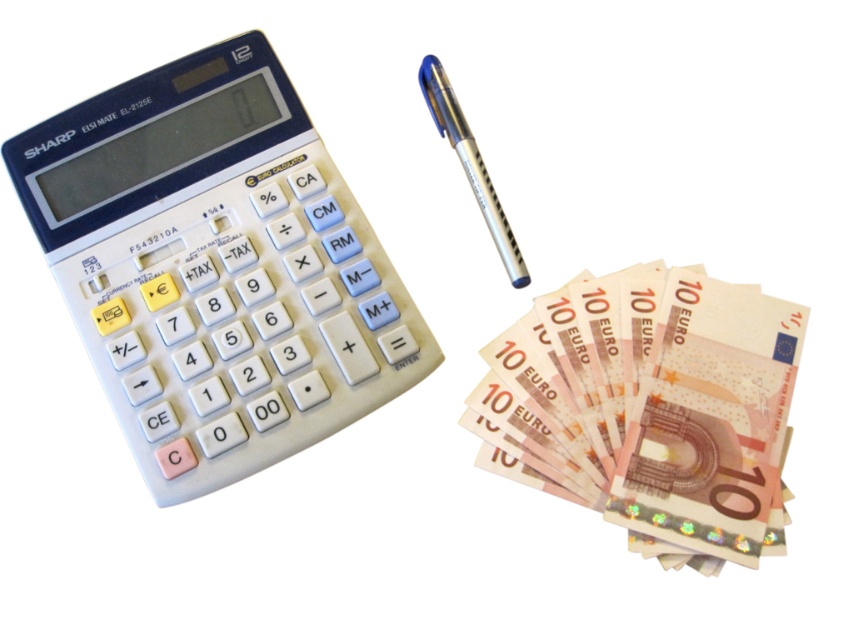
You are a financial advisor who needs to hand a client a document. You have a light pink paper money at right and a silver metallic pen at upper center on your desk. The distance between them is crucial for your gesture. Can you comfortably reach both items without moving your hand more than 8 inches?

The light pink paper money at right is 8.46 inches from the silver metallic pen at upper center. Since the distance is slightly over 8 inches, you cannot comfortably reach both items without moving your hand more than the specified limit.

You are a financial advisor organizing items on a desk. You have a light pink paper money at right and a silver metallic pen at upper center. Which item is taller?

The light pink paper money at right is much taller than the silver metallic pen at upper center.

You are organizing items on a desk and need to place the white plastic calculator at left and the silver metallic pen at upper center. If you want to arrange them vertically so that the taller item is above the shorter one, which item should be placed on top?

The white plastic calculator at left is much taller than the silver metallic pen at upper center, so it should be placed on top to follow the vertical arrangement requirement.